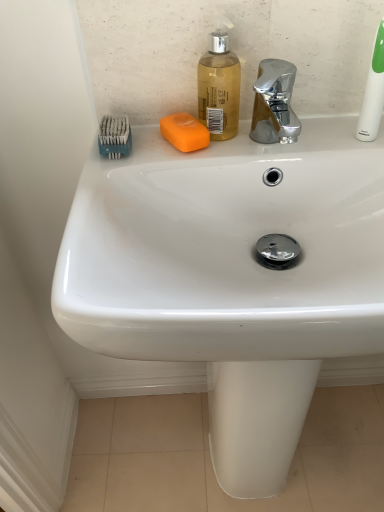
Measure the distance between point (208,133) and camera.

A distance of 25.04 inches exists between point (208,133) and camera.

Find the location of a particular element. Image resolution: width=384 pixels, height=512 pixels. white plastic toothbrush at upper right is located at coordinates (373, 92).

Where is `translucent plastic soap dispenser at upper center`? The width and height of the screenshot is (384, 512). translucent plastic soap dispenser at upper center is located at coordinates (219, 86).

What do you see at coordinates (114, 136) in the screenshot? I see `teal plastic toothbrush at upper left` at bounding box center [114, 136].

Where is `orange matte soap at center`? The width and height of the screenshot is (384, 512). orange matte soap at center is located at coordinates coord(184,132).

Considering the relative sizes of translucent plastic soap dispenser at upper center and teal plastic toothbrush at upper left in the image provided, is translucent plastic soap dispenser at upper center thinner than teal plastic toothbrush at upper left?

Indeed, translucent plastic soap dispenser at upper center has a lesser width compared to teal plastic toothbrush at upper left.

Does translucent plastic soap dispenser at upper center appear on the left side of teal plastic toothbrush at upper left?

Incorrect, translucent plastic soap dispenser at upper center is not on the left side of teal plastic toothbrush at upper left.

Is teal plastic toothbrush at upper left located within translucent plastic soap dispenser at upper center?

Actually, teal plastic toothbrush at upper left is outside translucent plastic soap dispenser at upper center.

From a real-world perspective, does translucent plastic soap dispenser at upper center sit lower than teal plastic toothbrush at upper left?

No, from a real-world perspective, translucent plastic soap dispenser at upper center is not under teal plastic toothbrush at upper left.

Which of these two, teal plastic toothbrush at upper left or white plastic toothbrush at upper right, is wider?

With larger width is teal plastic toothbrush at upper left.

Is teal plastic toothbrush at upper left smaller than white plastic toothbrush at upper right?

Correct, teal plastic toothbrush at upper left occupies less space than white plastic toothbrush at upper right.

Where is `toothbrush above the teal plastic toothbrush at upper left (from a real-world perspective)`? This screenshot has width=384, height=512. toothbrush above the teal plastic toothbrush at upper left (from a real-world perspective) is located at coordinates (373, 92).

Looking at this image, measure the distance from teal plastic toothbrush at upper left to white plastic toothbrush at upper right.

teal plastic toothbrush at upper left is 35.16 centimeters from white plastic toothbrush at upper right.

Is orange matte soap at center closer to camera compared to teal plastic toothbrush at upper left?

No.

What's the angular difference between orange matte soap at center and teal plastic toothbrush at upper left's facing directions?

orange matte soap at center and teal plastic toothbrush at upper left are facing 19.4 degrees away from each other.

Considering the positions of objects orange matte soap at center and teal plastic toothbrush at upper left in the image provided, who is more to the right, orange matte soap at center or teal plastic toothbrush at upper left?

orange matte soap at center is more to the right.

Are orange matte soap at center and teal plastic toothbrush at upper left far apart?

orange matte soap at center is near teal plastic toothbrush at upper left, not far away.

Could you measure the distance between white plastic toothbrush at upper right and translucent plastic soap dispenser at upper center?

white plastic toothbrush at upper right is 8.10 inches from translucent plastic soap dispenser at upper center.

From a real-world perspective, relative to translucent plastic soap dispenser at upper center, is white plastic toothbrush at upper right vertically above or below?

white plastic toothbrush at upper right is situated higher than translucent plastic soap dispenser at upper center in the real world.

Locate an element on the screen. The height and width of the screenshot is (512, 384). soap dispenser below the white plastic toothbrush at upper right (from the image's perspective) is located at coordinates (219, 86).

Who is taller, white plastic toothbrush at upper right or translucent plastic soap dispenser at upper center?

Standing taller between the two is white plastic toothbrush at upper right.

Is white plastic toothbrush at upper right aimed at teal plastic toothbrush at upper left?

No, white plastic toothbrush at upper right is not facing towards teal plastic toothbrush at upper left.

Is teal plastic toothbrush at upper left completely or partially inside white plastic toothbrush at upper right?

No, teal plastic toothbrush at upper left is not surrounded by white plastic toothbrush at upper right.

From their relative heights in the image, would you say white plastic toothbrush at upper right is taller or shorter than teal plastic toothbrush at upper left?

Clearly, white plastic toothbrush at upper right is taller compared to teal plastic toothbrush at upper left.

Is teal plastic toothbrush at upper left facing towards translucent plastic soap dispenser at upper center?

No.

Is translucent plastic soap dispenser at upper center completely or partially inside teal plastic toothbrush at upper left?

That's incorrect, translucent plastic soap dispenser at upper center is not inside teal plastic toothbrush at upper left.

From a real-world perspective, is teal plastic toothbrush at upper left above or below translucent plastic soap dispenser at upper center?

teal plastic toothbrush at upper left is situated lower than translucent plastic soap dispenser at upper center in the real world.

Can you see teal plastic toothbrush at upper left touching translucent plastic soap dispenser at upper center?

No.

Is teal plastic toothbrush at upper left positioned with its back to orange matte soap at center?

No, teal plastic toothbrush at upper left is not facing away from orange matte soap at center.

Is point (99, 130) behind point (179, 127)?

Yes.

Is teal plastic toothbrush at upper left wider or thinner than orange matte soap at center?

Considering their sizes, teal plastic toothbrush at upper left looks slimmer than orange matte soap at center.

Which object is positioned more to the left, teal plastic toothbrush at upper left or orange matte soap at center?

teal plastic toothbrush at upper left is more to the left.

Where is `soap dispenser above the teal plastic toothbrush at upper left (from a real-world perspective)`? This screenshot has width=384, height=512. soap dispenser above the teal plastic toothbrush at upper left (from a real-world perspective) is located at coordinates (219, 86).

I want to click on toothbrush lying on the right of teal plastic toothbrush at upper left, so click(x=373, y=92).

Which object lies further to the anchor point orange matte soap at center, teal plastic toothbrush at upper left or white plastic toothbrush at upper right?

white plastic toothbrush at upper right.

Estimate the real-world distances between objects in this image. Which object is closer to translucent plastic soap dispenser at upper center, white plastic toothbrush at upper right or teal plastic toothbrush at upper left?

Among the two, teal plastic toothbrush at upper left is located nearer to translucent plastic soap dispenser at upper center.

When comparing their distances from translucent plastic soap dispenser at upper center, does teal plastic toothbrush at upper left or white plastic toothbrush at upper right seem closer?

teal plastic toothbrush at upper left lies closer to translucent plastic soap dispenser at upper center than the other object.

Estimate the real-world distances between objects in this image. Which object is closer to white plastic toothbrush at upper right, orange matte soap at center or teal plastic toothbrush at upper left?

The object closer to white plastic toothbrush at upper right is orange matte soap at center.

When comparing their distances from orange matte soap at center, does translucent plastic soap dispenser at upper center or white plastic toothbrush at upper right seem further?

white plastic toothbrush at upper right is further to orange matte soap at center.

Based on their spatial positions, is teal plastic toothbrush at upper left or translucent plastic soap dispenser at upper center closer to white plastic toothbrush at upper right?

translucent plastic soap dispenser at upper center is positioned closer to the anchor white plastic toothbrush at upper right.

Looking at the image, which one is located closer to white plastic toothbrush at upper right, orange matte soap at center or translucent plastic soap dispenser at upper center?

translucent plastic soap dispenser at upper center is closer to white plastic toothbrush at upper right.

Considering their positions, is orange matte soap at center positioned closer to translucent plastic soap dispenser at upper center than teal plastic toothbrush at upper left?

orange matte soap at center is closer to translucent plastic soap dispenser at upper center.

Identify the location of soap dispenser located between teal plastic toothbrush at upper left and white plastic toothbrush at upper right in the left-right direction. (219, 86).

Where is `soap between teal plastic toothbrush at upper left and white plastic toothbrush at upper right in the horizontal direction`? Image resolution: width=384 pixels, height=512 pixels. soap between teal plastic toothbrush at upper left and white plastic toothbrush at upper right in the horizontal direction is located at coordinates (184, 132).

You are a GUI agent. You are given a task and a screenshot of the screen. Output one action in this format:
    pyautogui.click(x=<x>, y=<y>)
    Task: Click on the soap located between teal plastic toothbrush at upper left and translucent plastic soap dispenser at upper center in the left-right direction
    
    Given the screenshot: What is the action you would take?
    pyautogui.click(x=184, y=132)

I want to click on soap dispenser between orange matte soap at center and white plastic toothbrush at upper right from left to right, so click(x=219, y=86).